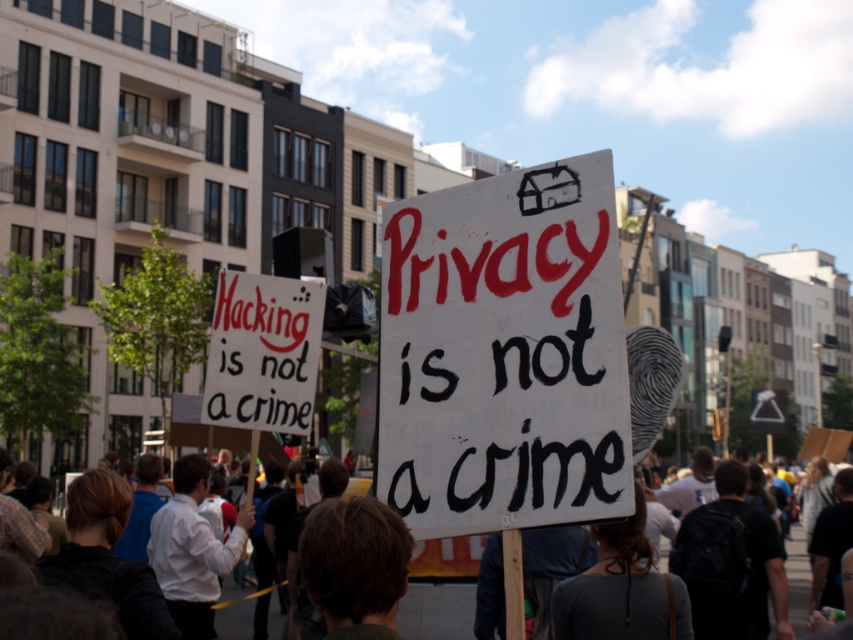
You are a photographer at the protest scene. You want to capture a clear photo of the white painted cardboard sign at center without any obstruction. Is the dark brown hair at center blocking the sign?

The white painted cardboard sign at center is in front of dark brown hair at center, so the sign is not blocked by the hair and can be clearly photographed.

You are a photographer standing at the edge of the protest crowd. You want to take a photo that includes both the white painted cardboard sign at center and the white paper sign at center. The minimum distance between the two signs in your camera frame must be at least 30 feet to ensure clarity. Based on their actual distance, will this be possible?

The white painted cardboard sign at center and white paper sign at center are 29.31 feet apart from each other. Since 29.31 feet is less than the required 30 feet, the photographer cannot achieve the desired minimum distance in the frame.

You are a journalist trying to capture both the white painted cardboard sign at center and the white paper sign at center in a single photo. Which sign should you adjust your camera angle to focus on first if you want to ensure both are visible in the frame?

The white painted cardboard sign at center is positioned on the right side of white paper sign at center, so you should focus on the white painted cardboard sign at center first to ensure both are visible in the frame.